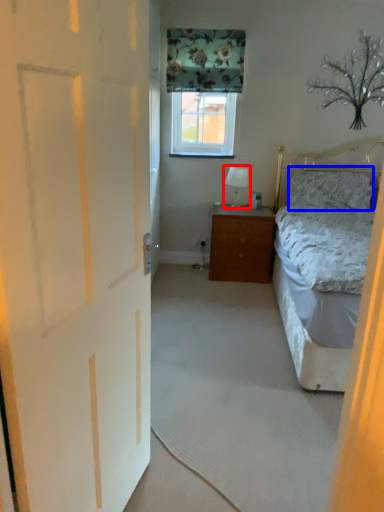
Question: Among these objects, which one is farthest to the camera, table lamp (highlighted by a red box) or pillow (highlighted by a blue box)?

Choices:
 (A) table lamp
 (B) pillow

Answer: (A)